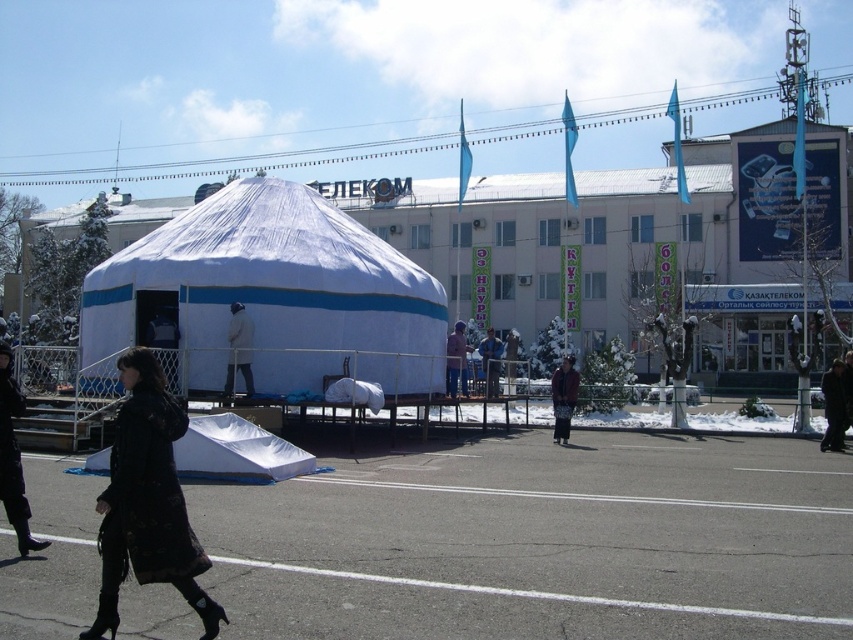
You are a photographer positioned on the street. You want to take a photo that includes both the white fabric tent at center and the dark brown textured coat at center. Which object should you focus on first to ensure both are in sharp focus?

The white fabric tent at center is closer to the viewer than the dark brown textured coat at center. To ensure both are in sharp focus, focus on the white fabric tent at center first since it is closer, and the depth of field will extend to the darker coat.

You are standing at the point with coordinates point (216, 288) and want to walk to point (561, 358). Which direction should you move to get closer to your destination?

Since point (216, 288) is closer to the viewer than point (561, 358), you should move backward to reach your destination.